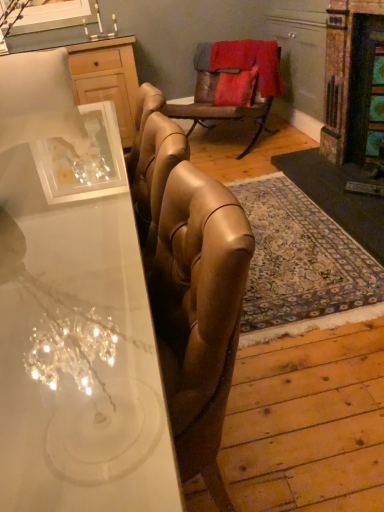
What is the approximate height of leather armchair at center?

leather armchair at center is 30.82 inches in height.

What is the approximate height of white glossy desk at center?

30.89 inches.

What do you see at coordinates (73, 80) in the screenshot?
I see `wooden cabinet at upper left` at bounding box center [73, 80].

What is the approximate height of wooden cabinet at upper left?

It is 38.22 inches.

Find the location of a particular element. The height and width of the screenshot is (512, 384). rustic stone fireplace at right is located at coordinates (349, 76).

Identify the location of leather armchair at center. (233, 84).

Considering the points (34, 351) and (244, 69), which point is in front, point (34, 351) or point (244, 69)?

The point (34, 351) is more forward.

Is white glossy desk at center taller than leather armchair at center?

Indeed, white glossy desk at center has a greater height compared to leather armchair at center.

From a real-world perspective, is white glossy desk at center positioned above or below leather armchair at center?

Clearly, from a real-world perspective, white glossy desk at center is above leather armchair at center.

Considering the sizes of rustic stone fireplace at right and leather armchair at center in the image, is rustic stone fireplace at right bigger or smaller than leather armchair at center?

In the image, rustic stone fireplace at right appears to be smaller than leather armchair at center.

Can you tell me how much rustic stone fireplace at right and leather armchair at center differ in facing direction?

46.4 degrees.

Image resolution: width=384 pixels, height=512 pixels. What are the coordinates of `chair that appears on the left of rustic stone fireplace at right` in the screenshot? It's located at (233, 84).

From the image's perspective, relative to leather armchair at center, is rustic stone fireplace at right above or below?

Clearly, from the image's perspective, rustic stone fireplace at right is below leather armchair at center.

From a real-world perspective, is rustic stone fireplace at right physically located above or below white glossy desk at center?

In terms of real-world spatial position, rustic stone fireplace at right is above white glossy desk at center.

Where is `desk located in front of the rustic stone fireplace at right`? This screenshot has height=512, width=384. desk located in front of the rustic stone fireplace at right is located at coordinates (76, 326).

How different are the orientations of rustic stone fireplace at right and white glossy desk at center in degrees?

The angular difference between rustic stone fireplace at right and white glossy desk at center is 89.7 degrees.

Is rustic stone fireplace at right not close to white glossy desk at center?

Yes, rustic stone fireplace at right and white glossy desk at center are quite far apart.

From the image's perspective, would you say leather armchair at center is shown under white glossy desk at center?

No.

How many degrees apart are the facing directions of leather armchair at center and white glossy desk at center?

The angular difference between leather armchair at center and white glossy desk at center is 136 degrees.

Based on their positions, is leather armchair at center located to the left or right of white glossy desk at center?

Based on their positions, leather armchair at center is located to the right of white glossy desk at center.

Is the depth of leather armchair at center greater than that of wooden cabinet at upper left?

That is False.

What's the angular difference between leather armchair at center and wooden cabinet at upper left's facing directions?

43.4 degrees.

From a real-world perspective, which is physically above, leather armchair at center or wooden cabinet at upper left?

From a 3D spatial view, wooden cabinet at upper left is above.

Is leather armchair at center looking in the opposite direction of wooden cabinet at upper left?

No, leather armchair at center is not facing away from wooden cabinet at upper left.

Between wooden cabinet at upper left and rustic stone fireplace at right, which one appears on the left side from the viewer's perspective?

From the viewer's perspective, wooden cabinet at upper left appears more on the left side.

The width and height of the screenshot is (384, 512). Find the location of `cabinetry below the rustic stone fireplace at right (from a real-world perspective)`. cabinetry below the rustic stone fireplace at right (from a real-world perspective) is located at coordinates (73, 80).

Which point is more forward, (63,66) or (364,69)?

The point (63,66) is more forward.

Is wooden cabinet at upper left further to the viewer compared to rustic stone fireplace at right?

Yes, wooden cabinet at upper left is further from the camera.

How many degrees apart are the facing directions of wooden cabinet at upper left and white glossy desk at center?

The angular difference between wooden cabinet at upper left and white glossy desk at center is 180 degrees.

Is wooden cabinet at upper left not inside white glossy desk at center?

Yes, wooden cabinet at upper left is not within white glossy desk at center.

Does wooden cabinet at upper left have a lesser height compared to white glossy desk at center?

Incorrect, the height of wooden cabinet at upper left does not fall short of that of white glossy desk at center.

From the image's perspective, is wooden cabinet at upper left located above or below white glossy desk at center?

Based on their image positions, wooden cabinet at upper left is located above white glossy desk at center.

The image size is (384, 512). I want to click on desk above the leather armchair at center (from a real-world perspective), so click(x=76, y=326).

At what (x,y) coordinates should I click in order to perform the action: click on fireplace in front of the leather armchair at center. Please return your answer as a coordinate pair (x, y). Looking at the image, I should click on (349, 76).

In the scene shown: When comparing their distances from rustic stone fireplace at right, does white glossy desk at center or leather armchair at center seem further?

white glossy desk at center is further to rustic stone fireplace at right.

Based on their spatial positions, is rustic stone fireplace at right or white glossy desk at center further from wooden cabinet at upper left?

white glossy desk at center.

Which object lies further to the anchor point rustic stone fireplace at right, wooden cabinet at upper left or leather armchair at center?

The object further to rustic stone fireplace at right is wooden cabinet at upper left.

Considering their positions, is leather armchair at center positioned closer to rustic stone fireplace at right than wooden cabinet at upper left?

leather armchair at center.

Which object lies nearer to the anchor point white glossy desk at center, rustic stone fireplace at right or leather armchair at center?

rustic stone fireplace at right lies closer to white glossy desk at center than the other object.

From the image, which object appears to be farther from leather armchair at center, rustic stone fireplace at right or white glossy desk at center?

white glossy desk at center is positioned further to the anchor leather armchair at center.

Based on their spatial positions, is wooden cabinet at upper left or white glossy desk at center closer to leather armchair at center?

wooden cabinet at upper left lies closer to leather armchair at center than the other object.

Which object lies further to the anchor point leather armchair at center, rustic stone fireplace at right or wooden cabinet at upper left?

rustic stone fireplace at right is further to leather armchair at center.

You are a GUI agent. You are given a task and a screenshot of the screen. Output one action in this format:
    pyautogui.click(x=<x>, y=<y>)
    Task: Click on the chair between white glossy desk at center and wooden cabinet at upper left in the front-back direction
    The height and width of the screenshot is (512, 384).
    Given the screenshot: What is the action you would take?
    pyautogui.click(x=233, y=84)

At what (x,y) coordinates should I click in order to perform the action: click on fireplace positioned between white glossy desk at center and leather armchair at center from near to far. Please return your answer as a coordinate pair (x, y). Looking at the image, I should click on (349, 76).

At what (x,y) coordinates should I click in order to perform the action: click on chair between wooden cabinet at upper left and rustic stone fireplace at right in the horizontal direction. Please return your answer as a coordinate pair (x, y). The width and height of the screenshot is (384, 512). Looking at the image, I should click on (233, 84).

The height and width of the screenshot is (512, 384). I want to click on fireplace between white glossy desk at center and wooden cabinet at upper left in the front-back direction, so click(x=349, y=76).